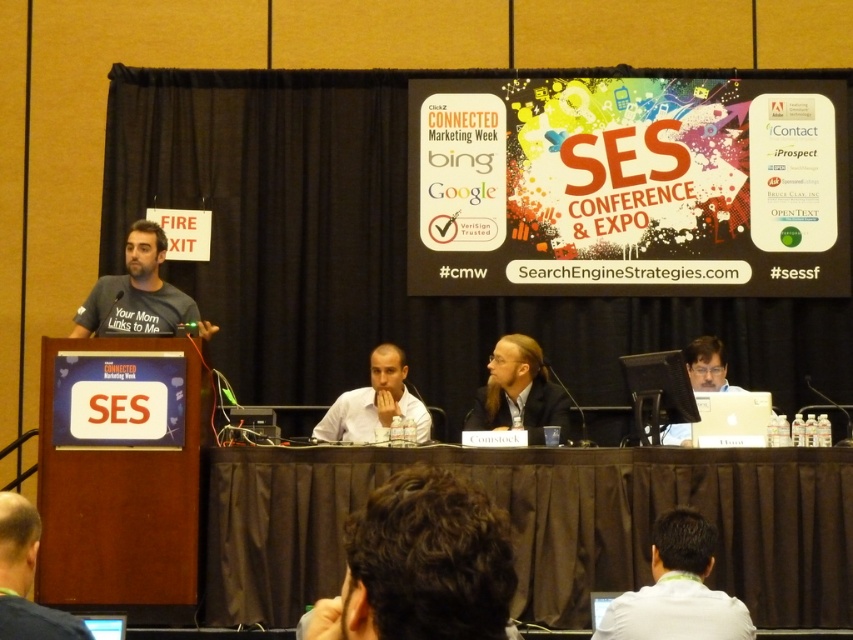
Question: Can you confirm if brown fabric table at lower center is positioned below dark brown hair at lower center?

Choices:
 (A) yes
 (B) no

Answer: (A)

Question: Is brown fabric table at lower center wider than light brown wood table at center?

Choices:
 (A) yes
 (B) no

Answer: (B)

Question: Is dark blue shirt at lower left thinner than matte black laptop at right?

Choices:
 (A) yes
 (B) no

Answer: (B)

Question: Which of these objects is positioned closest to the white shirt at lower right?

Choices:
 (A) dark blue shirt at lower left
 (B) dark gray t-shirt at left
 (C) brown fabric table at lower center
 (D) dark brown hair at lower center

Answer: (D)

Question: Which is nearer to the smooth white shirt at center?

Choices:
 (A) brown fabric table at lower center
 (B) dark brown hair at lower center
 (C) white shirt at lower right
 (D) matte black laptop at right

Answer: (A)

Question: Which point is closer to the camera?

Choices:
 (A) (700, 364)
 (B) (817, 513)

Answer: (B)